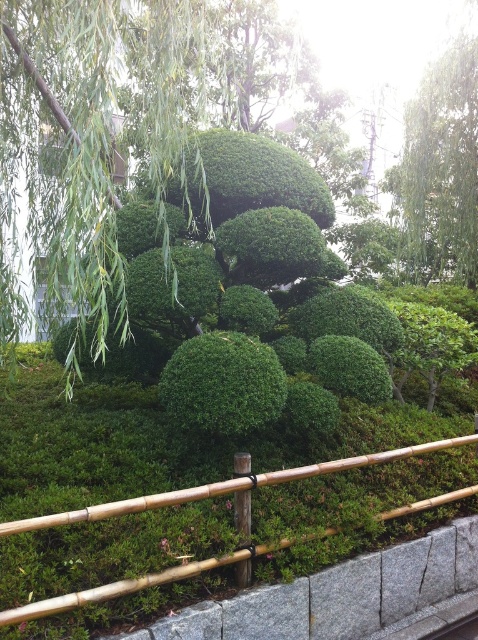
You are a gardener who needs to place a 3 meter wide decorative stone path between the green leafy bush at center and the green leafy tree at upper right. Is there enough space to fit the path between them?

The green leafy bush at center and green leafy tree at upper right are 6.69 meters apart, so yes, the 3 meter wide decorative stone path can be placed between them since the distance between them is greater than the path width.

You are a gardener planning to prune the green leafy tree at upper right and the bamboo fence at center. Which object requires trimming to be shorter than the other?

The green leafy tree at upper right is taller than the bamboo fence at center, so you should trim the green leafy tree at upper right to make it shorter than the bamboo fence at center.

You are a gardener who wants to place a new decorative rock garden ornament that is 10 feet long between the gray granite curb at lower center and the weeping willow tree on the left. Can the ornament fit in the space between them?

The gray granite curb at lower center and the weeping willow tree on the left are 10.25 feet apart. Since the ornament is 10 feet long, it can fit between them with a small amount of space remaining.